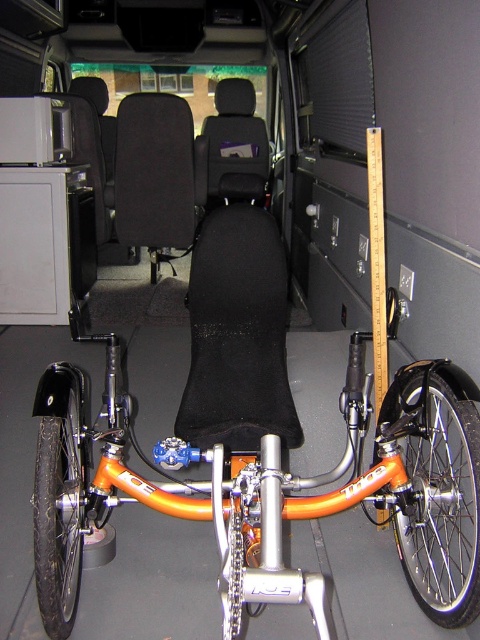
You are trying to determine if the black rubber tire at left can fit under the black fabric seat at center when storing the bicycle. Based on their heights, can the tire be placed underneath the seat without any issues?

The black fabric seat at center has a greater height compared to the black rubber tire at left. Since the seat is taller than the tire, the tire can be placed underneath the seat without any issues.

You are a delivery person who needs to secure a package in the van. The package must be placed exactly at the point with coordinates point (238, 333). Where should you place the package?

The package should be placed on the black fabric seat at center, as the point (238, 333) is located there.

Looking at this image, you are loading a recumbent trike into a van and need to ensure proper positioning. The trike has a black rubber tire at left and a black fabric seat at center. Which object is positioned to the right side when viewed from the van interior?

The black fabric seat at center is positioned to the right of the black rubber tire at left.